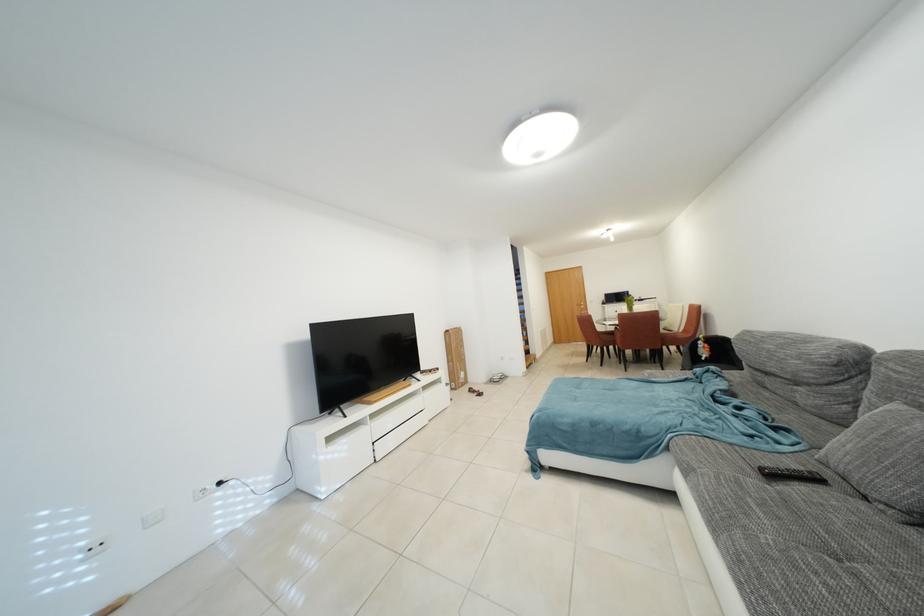
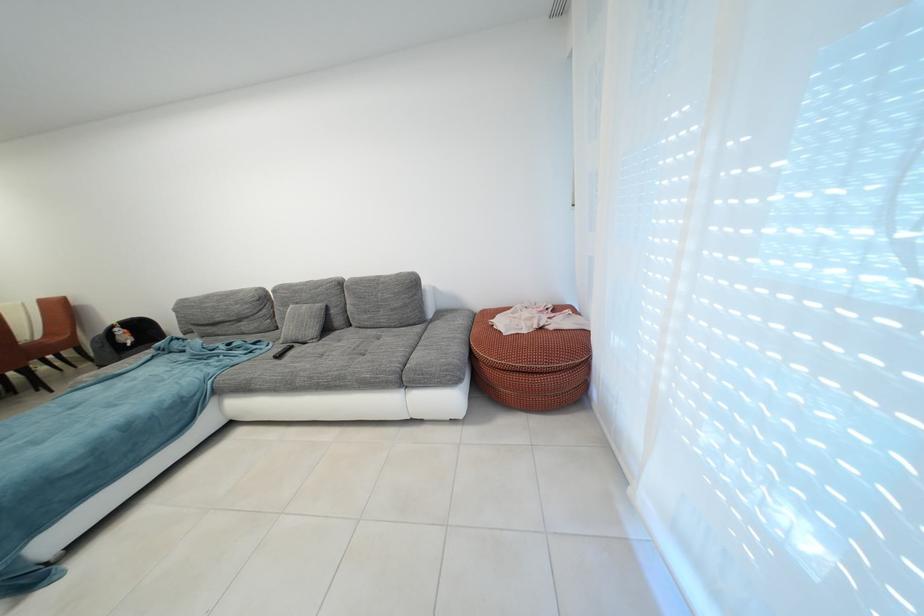
In the second image, find the point that corresponds to (781,480) in the first image.

(287, 361)